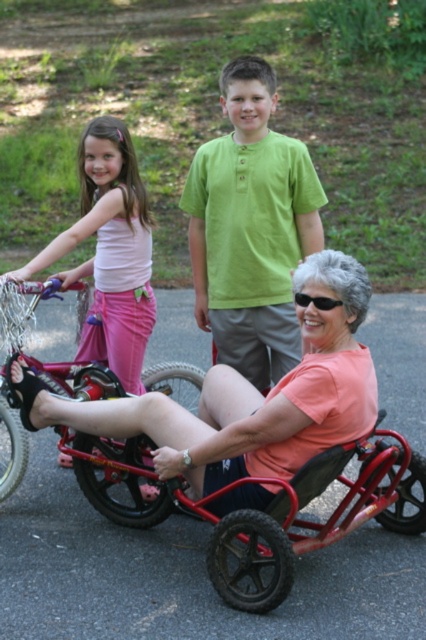
Question: Is pink fabric wheelchair at center thinner than metallic red bicycle at center?

Choices:
 (A) no
 (B) yes

Answer: (A)

Question: Which of the following is the closest to the observer?

Choices:
 (A) (92, 192)
 (B) (368, 360)
 (C) (273, 256)

Answer: (B)

Question: Does pink fabric wheelchair at center have a greater width compared to matte pink shorts at left?

Choices:
 (A) yes
 (B) no

Answer: (A)

Question: Does pink fabric wheelchair at center appear under matte pink shorts at left?

Choices:
 (A) no
 (B) yes

Answer: (B)

Question: Which point is farther from the camera taking this photo?

Choices:
 (A) (8, 408)
 (B) (294, 342)
 (C) (129, 403)

Answer: (B)

Question: Based on their relative distances, which object is nearer to the pink fabric wheelchair at center?

Choices:
 (A) green cotton shirt at center
 (B) matte pink shorts at left
 (C) metallic red bicycle at center

Answer: (C)